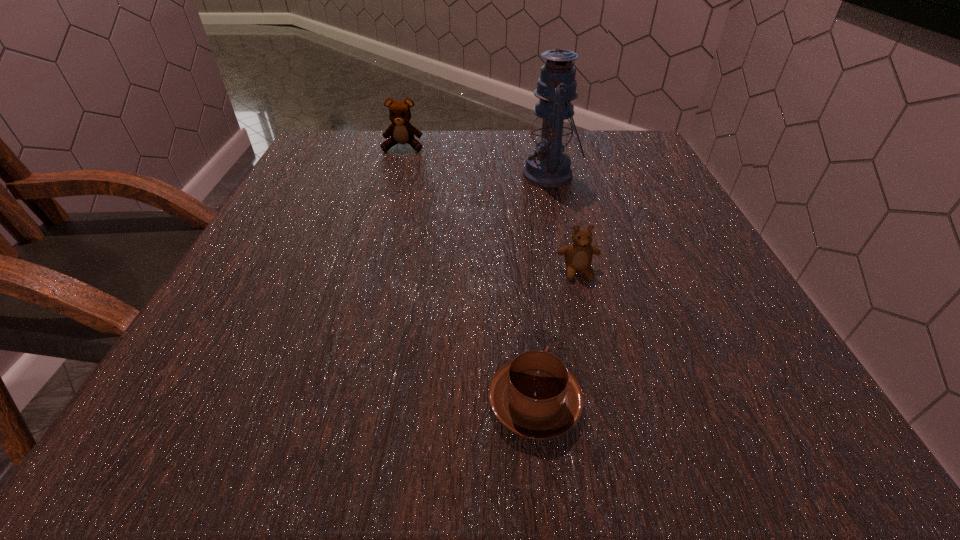
Where is `vacant space located on the front-facing side of the tallest object`? The height and width of the screenshot is (540, 960). vacant space located on the front-facing side of the tallest object is located at coordinates (368, 175).

This screenshot has height=540, width=960. In order to click on blank space located on the front-facing side of the farther teddy bear in this screenshot , I will do `click(376, 240)`.

Where is `free spot located 0.280m on the front-facing side of the right teddy bear`? The width and height of the screenshot is (960, 540). free spot located 0.280m on the front-facing side of the right teddy bear is located at coordinates (622, 449).

I want to click on vacant space located 0.060m on the side of the shortest object with the handle, so click(527, 331).

This screenshot has width=960, height=540. Identify the location of free space located 0.200m on the side of the shortest object with the handle. (520, 267).

The height and width of the screenshot is (540, 960). In order to click on free location located 0.350m on the side of the shortest object with the handle in this screenshot , I will do `click(516, 217)`.

Where is `lantern located at the far edge`? lantern located at the far edge is located at coordinates (548, 167).

I want to click on teddy bear that is at the far edge, so click(401, 131).

Identify the location of object located in the near edge section of the desktop. [535, 396].

Where is `free space at the far edge of the desktop`? free space at the far edge of the desktop is located at coordinates (516, 131).